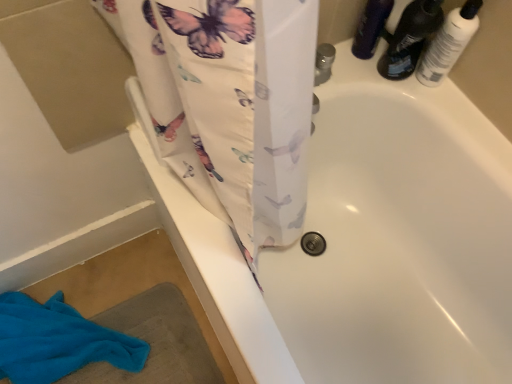
Question: From the image's perspective, relative to translucent plastic bottles at upper right, is matte black bottle at upper right, marked as the second toiletry in a right-to-left arrangement, above or below?

Choices:
 (A) below
 (B) above

Answer: (B)

Question: Is matte black bottle at upper right, the first toiletry from the left, to the left or to the right of translucent plastic bottles at upper right in the image?

Choices:
 (A) left
 (B) right

Answer: (A)

Question: Based on their relative distances, which object is farther from the blue cotton towel at lower left?

Choices:
 (A) matte black bottle at upper right, the first toiletry from the left
 (B) white glossy bottle at upper right, positioned as the first toiletry in right-to-left order
 (C) translucent plastic bottles at upper right

Answer: (B)

Question: Which is nearer to the white glossy bottle at upper right, positioned as the first toiletry in right-to-left order?

Choices:
 (A) matte black bottle at upper right, the first toiletry from the left
 (B) blue cotton towel at lower left
 (C) translucent plastic bottles at upper right

Answer: (C)